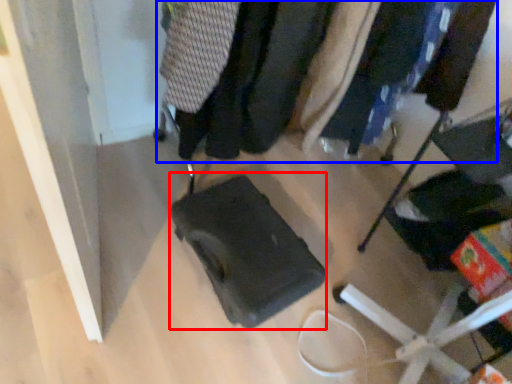
Question: Which object is closer to the camera taking this photo, luggage (highlighted by a red box) or closet (highlighted by a blue box)?

Choices:
 (A) luggage
 (B) closet

Answer: (B)